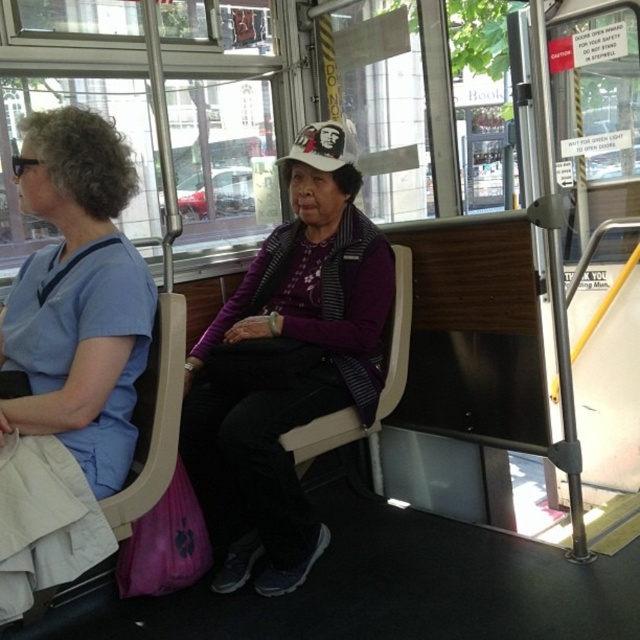
Question: Does purple matte sweater at center have a lesser width compared to blue scrubs at left?

Choices:
 (A) no
 (B) yes

Answer: (A)

Question: Does purple matte sweater at center appear under blue scrubs at left?

Choices:
 (A) no
 (B) yes

Answer: (B)

Question: From the image, what is the correct spatial relationship of purple matte sweater at center in relation to blue scrubs at left?

Choices:
 (A) left
 (B) right

Answer: (B)

Question: Which point is farther to the camera?

Choices:
 (A) blue scrubs at left
 (B) purple matte sweater at center

Answer: (B)

Question: Which point appears farthest from the camera in this image?

Choices:
 (A) (29, 212)
 (B) (221, 433)

Answer: (B)